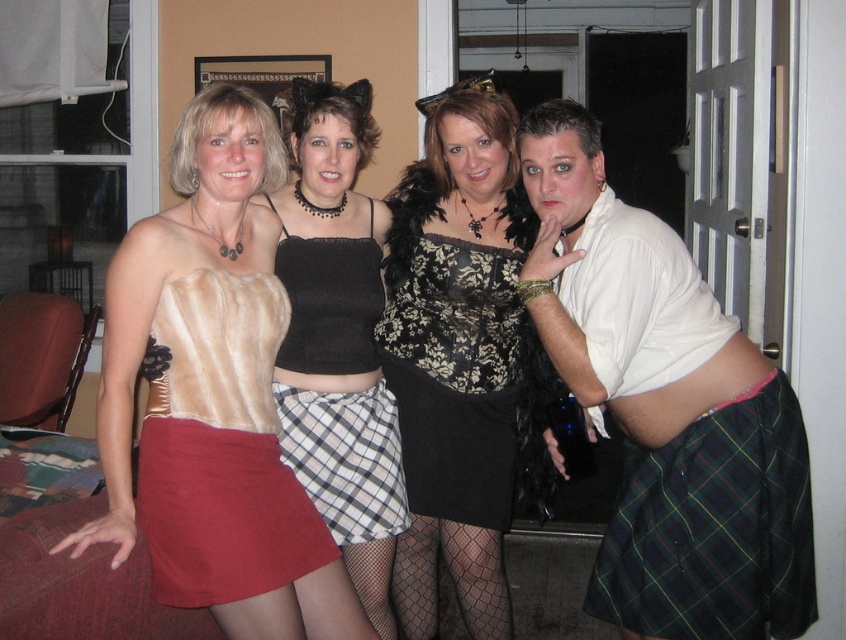
Between point (487, 88) and point (198, 128), which one is positioned behind?

Positioned behind is point (487, 88).

Is black lace dress at center closer to the viewer compared to satin skirt at lower left?

No, black lace dress at center is further to the viewer.

Between point (470, 90) and point (205, 122), which one is positioned in front?

Point (205, 122)

Locate an element on the screen. This screenshot has height=640, width=846. black lace dress at center is located at coordinates (462, 358).

In the scene shown: Is matte white shirt at right smaller than suede skirt at lower left?

No, matte white shirt at right is not smaller than suede skirt at lower left.

Which is more to the left, matte white shirt at right or suede skirt at lower left?

suede skirt at lower left

Who is more forward, [680,449] or [233,586]?

Point [233,586] is more forward.

The height and width of the screenshot is (640, 846). In order to click on matte white shirt at right in this screenshot , I will do `click(667, 408)`.

Does pink fabric at lower right appear on the left side of suede skirt at lower left?

Incorrect, pink fabric at lower right is not on the left side of suede skirt at lower left.

Between pink fabric at lower right and suede skirt at lower left, which one appears on the right side from the viewer's perspective?

From the viewer's perspective, pink fabric at lower right appears more on the right side.

Is point (662, 541) in front of point (168, 420)?

No, (662, 541) is behind (168, 420).

This screenshot has width=846, height=640. Identify the location of pink fabric at lower right. [713, 528].